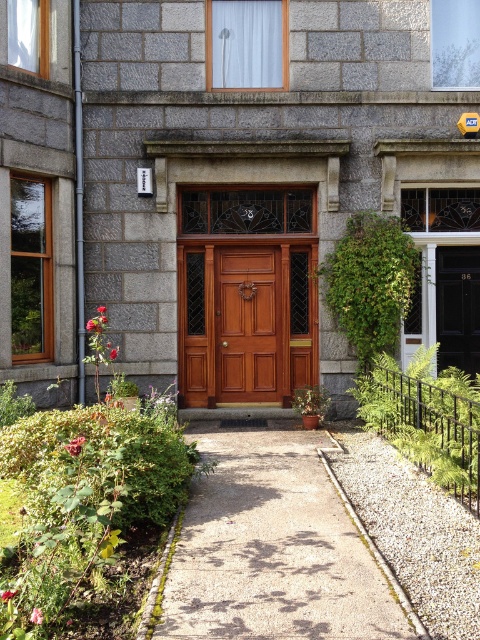
In the scene shown: Measure the distance between smooth concrete path at center and camera.

smooth concrete path at center and camera are 5.48 meters apart.

Where is `smooth concrete path at center`? smooth concrete path at center is located at coordinates (273, 548).

The width and height of the screenshot is (480, 640). Describe the element at coordinates (273, 548) in the screenshot. I see `smooth concrete path at center` at that location.

Locate an element on the screen. This screenshot has height=640, width=480. smooth concrete path at center is located at coordinates (273, 548).

Between polished wood door at center and matte wood door at center, which one is positioned higher?

polished wood door at center

Is polished wood door at center smaller than matte wood door at center?

Actually, polished wood door at center might be larger than matte wood door at center.

You are a GUI agent. You are given a task and a screenshot of the screen. Output one action in this format:
    pyautogui.click(x=<x>, y=<y>)
    Task: Click on the polished wood door at center
    This screenshot has height=640, width=480.
    Given the screenshot: What is the action you would take?
    tap(245, 323)

From the picture: Between smooth concrete path at center and polished wood door at center, which one appears on the right side from the viewer's perspective?

Positioned to the right is smooth concrete path at center.

Is the position of smooth concrete path at center more distant than that of polished wood door at center?

No.

Which is in front, point (280, 550) or point (307, 316)?

Point (280, 550) is in front.

I want to click on smooth concrete path at center, so click(x=273, y=548).